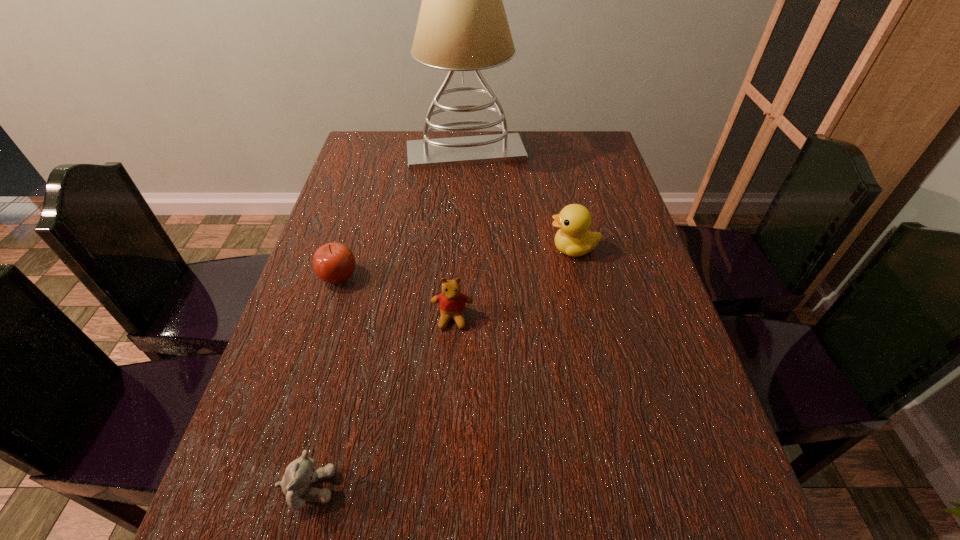
I want to click on free space located on the face of the duck, so click(x=458, y=249).

You are a GUI agent. You are given a task and a screenshot of the screen. Output one action in this format:
    pyautogui.click(x=<x>, y=<y>)
    Task: Click on the free space located 0.320m on the face of the duck
    The height and width of the screenshot is (540, 960).
    Given the screenshot: What is the action you would take?
    pyautogui.click(x=422, y=249)

This screenshot has height=540, width=960. Identify the location of free space located 0.260m on the face of the duck. (445, 249).

Where is `free space located 0.070m on the front-facing side of the farther teddy bear`? This screenshot has width=960, height=540. free space located 0.070m on the front-facing side of the farther teddy bear is located at coordinates (450, 359).

In order to click on free region located 0.080m on the right of the third nearest object in this screenshot , I will do `click(393, 276)`.

The image size is (960, 540). I want to click on vacant space situated on the face of the left teddy bear, so click(x=446, y=488).

The width and height of the screenshot is (960, 540). Find the location of `object present at the far edge`. object present at the far edge is located at coordinates (462, 26).

At what (x,y) coordinates should I click in order to perform the action: click on apple located in the left edge section of the desktop. Please return your answer as a coordinate pair (x, y). Looking at the image, I should click on (334, 263).

This screenshot has width=960, height=540. Identify the location of teddy bear present at the left edge. (300, 473).

Identify the location of object that is positioned at the right edge. (573, 238).